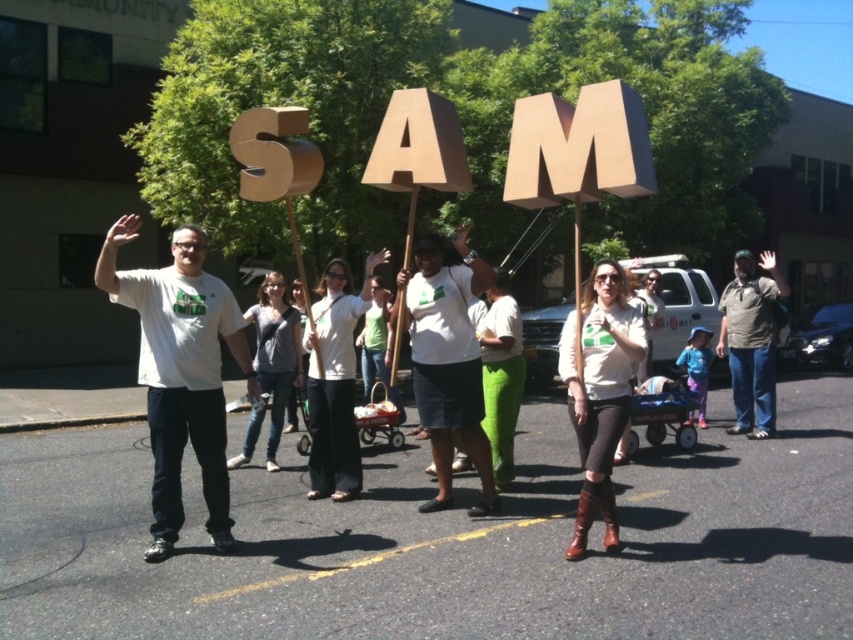
Question: Is white matte t-shirt at left closer to camera compared to gray cotton shirt at right?

Choices:
 (A) yes
 (B) no

Answer: (A)

Question: Does white matte t-shirt at left have a lesser width compared to gray cotton shirt at right?

Choices:
 (A) no
 (B) yes

Answer: (B)

Question: Which object appears closest to the camera in this image?

Choices:
 (A) gray cotton shirt at right
 (B) matte white sweater at center

Answer: (B)

Question: Which point is farther to the camera?

Choices:
 (A) white matte t-shirt at left
 (B) matte white sweater at center
 (C) gray cotton shirt at right

Answer: (C)

Question: Can you confirm if white matte t-shirt at left is thinner than gray cotton shirt at right?

Choices:
 (A) yes
 (B) no

Answer: (A)

Question: Estimate the real-world distances between objects in this image. Which object is farther from the white matte t-shirt at left?

Choices:
 (A) gray cotton shirt at right
 (B) matte white sweater at center

Answer: (A)